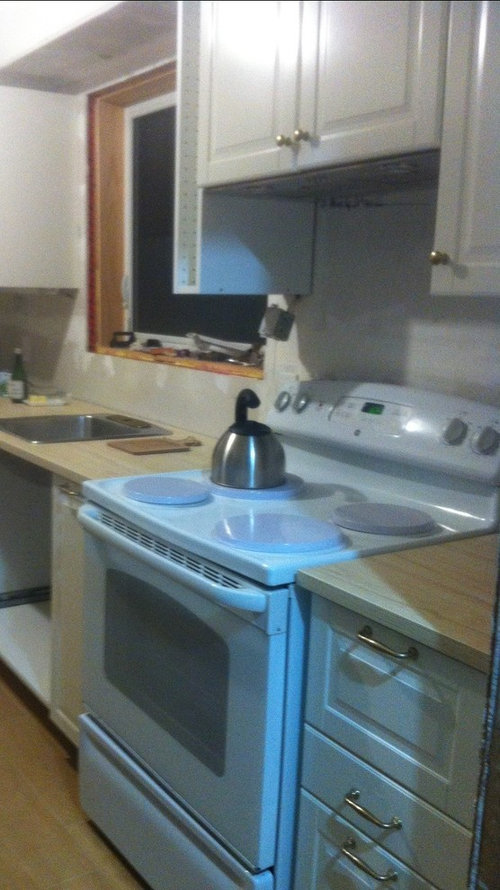
Identify the location of stove burners. (277, 531), (372, 514), (273, 489), (169, 491).